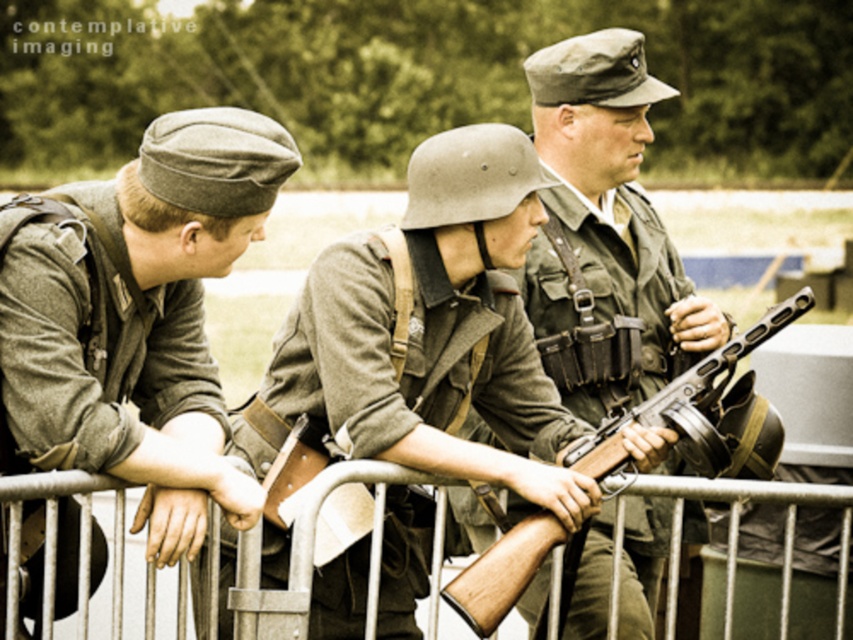
Does metallic silver fence at center have a lesser height compared to wooden stock rifle at center?

No, metallic silver fence at center is not shorter than wooden stock rifle at center.

Who is more distant from viewer, (434, 595) or (537, 529)?

The point (537, 529) is behind.

Between point (798, 499) and point (521, 564), which one is positioned in front?

Point (521, 564) is more forward.

The height and width of the screenshot is (640, 853). Identify the location of metallic silver fence at center. (305, 552).

Is matte green uniform at left to the left of metallic silver fence at center from the viewer's perspective?

Indeed, matte green uniform at left is positioned on the left side of metallic silver fence at center.

Measure the distance between matte green uniform at left and metallic silver fence at center.

They are 2.04 meters apart.

Is point (6, 368) less distant than point (769, 490)?

Yes.

Locate an element on the screen. This screenshot has width=853, height=640. matte green uniform at left is located at coordinates (137, 317).

Which is more to the right, matte green uniform at left or matte green uniform at center?

matte green uniform at center

Is matte green uniform at left below matte green uniform at center?

Actually, matte green uniform at left is above matte green uniform at center.

Is point (84, 268) positioned in front of point (653, 605)?

Yes, it is in front of point (653, 605).

Image resolution: width=853 pixels, height=640 pixels. I want to click on matte green uniform at left, so click(x=137, y=317).